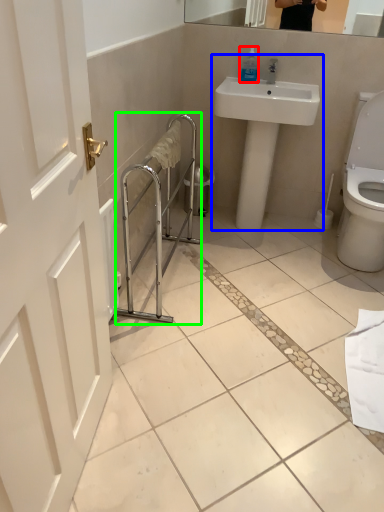
Question: Based on their relative distances, which object is farther from soap dispenser (highlighted by a red box)? Choose from sink (highlighted by a blue box) and balustrade (highlighted by a green box).

Choices:
 (A) sink
 (B) balustrade

Answer: (B)